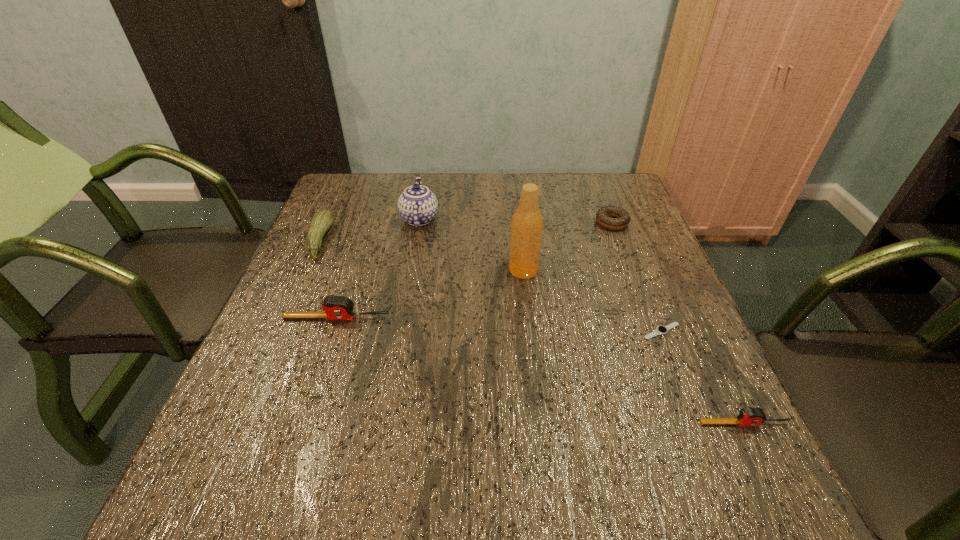
At what (x,y) coordinates should I click in order to perform the action: click on empty space that is in between the zucchini and the watch. Please return your answer as a coordinate pair (x, y). The image size is (960, 540). Looking at the image, I should click on (491, 286).

This screenshot has height=540, width=960. I want to click on free space between the nearest object and the doughnut, so click(x=678, y=323).

Image resolution: width=960 pixels, height=540 pixels. Find the location of `empty location between the sixth shortest object and the beer bottle`. empty location between the sixth shortest object and the beer bottle is located at coordinates click(471, 245).

This screenshot has width=960, height=540. Identify the location of free space that is in between the zucchini and the nearer tape measure. (532, 332).

Locate which object ranks fifth in proximity to the sixth tallest object. Please provide its 2D coordinates. Your answer should be formatted as a tuple, i.e. [(x, y)], where the tuple contains the x and y coordinates of a point satisfying the conditions above.

[(335, 307)]

Identify the location of object identified as the sixth closest to the watch. The height and width of the screenshot is (540, 960). (321, 222).

You are a GUI agent. You are given a task and a screenshot of the screen. Output one action in this format:
    pyautogui.click(x=<x>, y=<y>)
    Task: Click on the vacant point that satisfies the following two spatial constraints: 1. at the stem end of the zucchini; 2. on the right side of the beer bottle
    The height and width of the screenshot is (540, 960).
    Given the screenshot: What is the action you would take?
    pyautogui.click(x=307, y=270)

Identify the location of vacant position in the image that satisfies the following two spatial constraints: 1. at the stem end of the zucchini; 2. on the back side of the watch. The image size is (960, 540). (279, 331).

Where is `vacant space that satisfies the following two spatial constraints: 1. on the back side of the left tape measure; 2. at the stem end of the zucchini`? The height and width of the screenshot is (540, 960). vacant space that satisfies the following two spatial constraints: 1. on the back side of the left tape measure; 2. at the stem end of the zucchini is located at coordinates (362, 241).

This screenshot has height=540, width=960. I want to click on vacant space that satisfies the following two spatial constraints: 1. at the spout of the chinaware; 2. on the right side of the nearer tape measure, so click(383, 423).